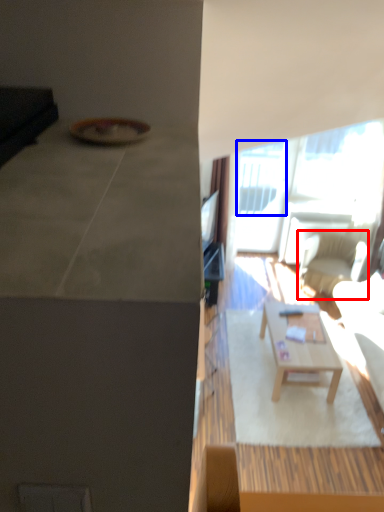
Question: Among these objects, which one is nearest to the camera, chair (highlighted by a red box) or window (highlighted by a blue box)?

Choices:
 (A) chair
 (B) window

Answer: (A)